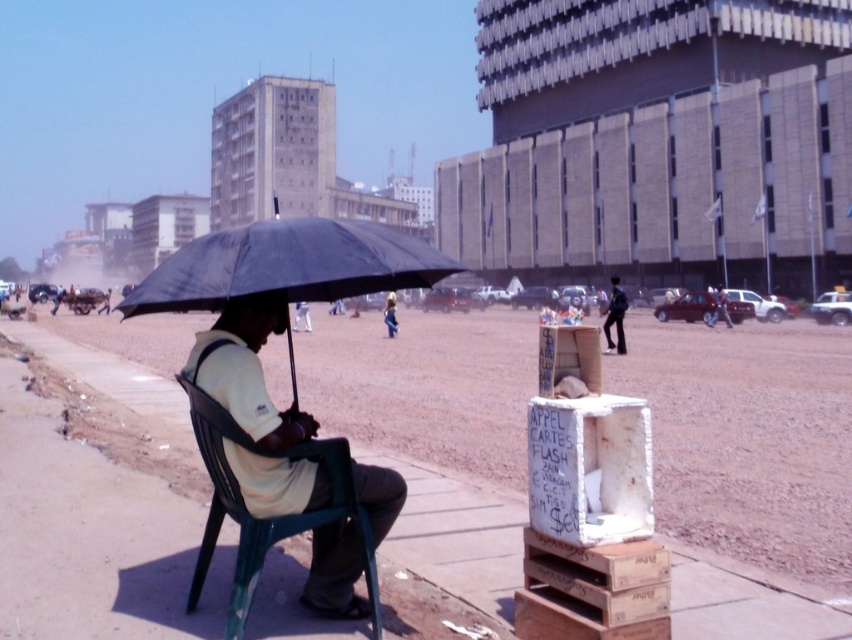
You are a delivery person trying to protect your package from the sun. You have a black matte umbrella at center and a green plastic chair at center available. Which object should you use to cover the package more effectively based on their sizes?

The black matte umbrella at center has a greater width than the green plastic chair at center, so it would provide better coverage for the package.